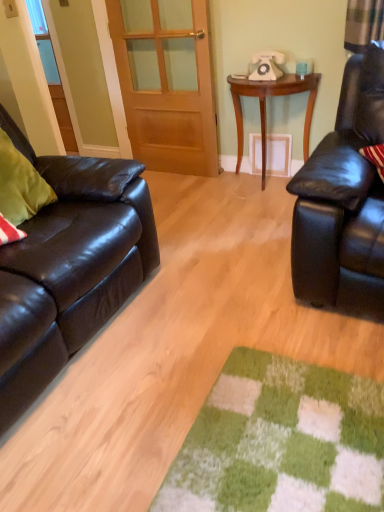
Where is `vacant space in front of wooden door at center`? vacant space in front of wooden door at center is located at coordinates (188, 196).